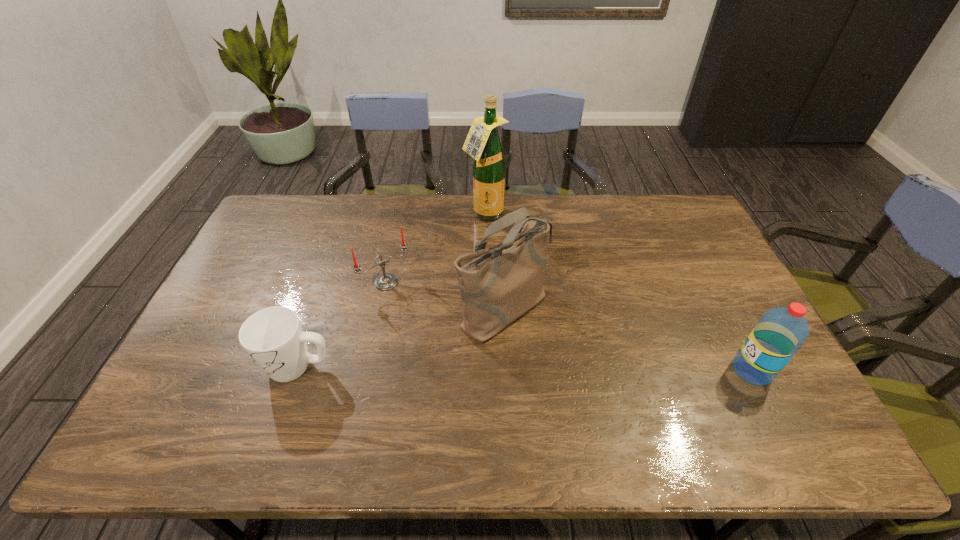
I want to click on vacant space situated on the front label of the third shortest object, so click(639, 370).

Locate an element on the screen. This screenshot has height=540, width=960. free space located 0.100m on the front label of the third shortest object is located at coordinates (694, 370).

Where is `vacant space located 0.360m on the front-facing side of the liquor`? vacant space located 0.360m on the front-facing side of the liquor is located at coordinates (526, 299).

What are the coordinates of `blank space located 0.080m on the front-facing side of the liquor` in the screenshot? It's located at pos(497,240).

Find the location of a particular element. vacant region located on the front-facing side of the liquor is located at coordinates (519, 285).

The height and width of the screenshot is (540, 960). I want to click on free space located on the front-facing side of the second object from left to right, so click(458, 359).

Where is `vacant space located on the front-facing side of the second object from left to right`? vacant space located on the front-facing side of the second object from left to right is located at coordinates (460, 361).

Locate an element on the screen. Image resolution: width=960 pixels, height=540 pixels. vacant space located 0.110m on the front-facing side of the second object from left to right is located at coordinates (419, 315).

Identify the location of vacant region located on the front-facing side of the second tallest object. (630, 402).

This screenshot has height=540, width=960. In order to click on free region located 0.210m on the front-facing side of the second tallest object in this screenshot , I will do `click(602, 382)`.